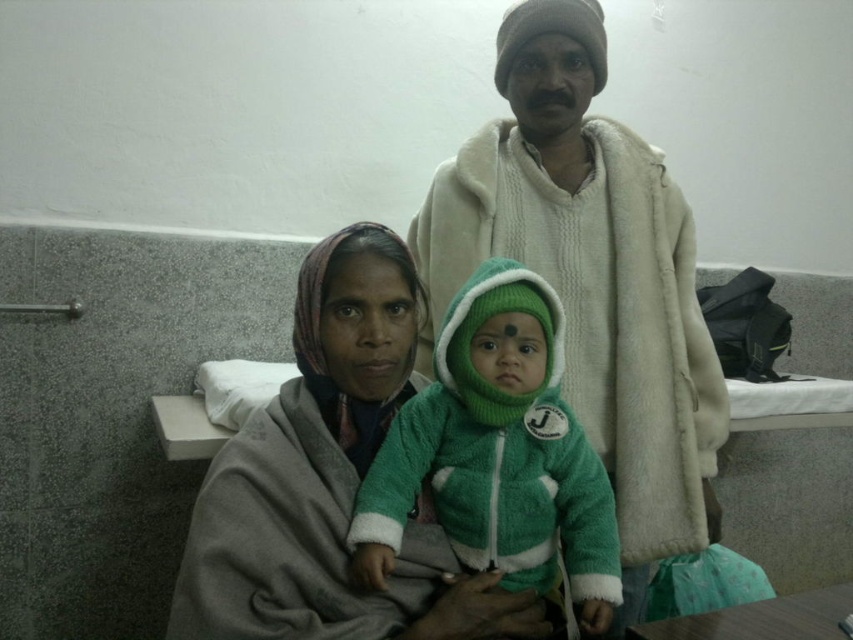
Question: Can you confirm if gray woolen shawl at center is positioned below green fuzzy jacket at center?

Choices:
 (A) yes
 (B) no

Answer: (B)

Question: Which point is farther to the camera?

Choices:
 (A) white fuzzy coat at upper center
 (B) green fuzzy jacket at center

Answer: (A)

Question: Does white fuzzy coat at upper center lie behind green fuzzy jacket at center?

Choices:
 (A) no
 (B) yes

Answer: (B)

Question: Which of these objects is positioned closest to the gray woolen shawl at center?

Choices:
 (A) green fuzzy jacket at center
 (B) white fuzzy coat at upper center

Answer: (A)

Question: Is gray woolen shawl at center positioned before green fuzzy jacket at center?

Choices:
 (A) no
 (B) yes

Answer: (B)

Question: Estimate the real-world distances between objects in this image. Which object is closer to the green fuzzy jacket at center?

Choices:
 (A) white fuzzy coat at upper center
 (B) gray woolen shawl at center

Answer: (B)